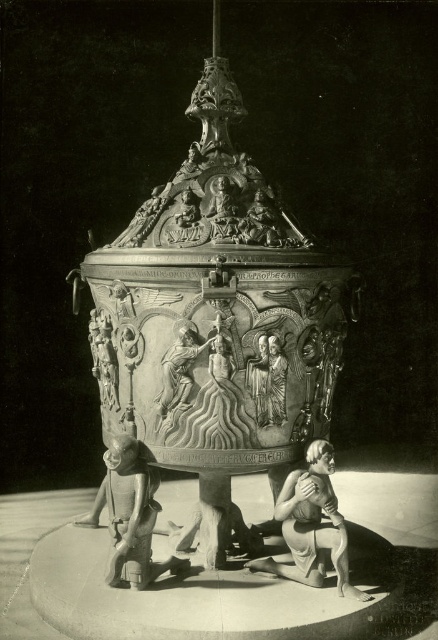
Question: In this image, where is polished bronze baptismal font at center located relative to bronze relief figure at center?

Choices:
 (A) above
 (B) below

Answer: (A)

Question: Which point appears farthest from the camera in this image?

Choices:
 (A) (328, 340)
 (B) (303, 500)

Answer: (A)

Question: Does matte bronze statue at lower center have a greater width compared to polished bronze figure at lower left?

Choices:
 (A) yes
 (B) no

Answer: (B)

Question: Which object is the closest to the matte bronze statue at lower center?

Choices:
 (A) polished bronze baptismal font at center
 (B) polished bronze figure at lower left

Answer: (B)

Question: Is the position of polished bronze baptismal font at center less distant than that of polished bronze figure at lower left?

Choices:
 (A) yes
 (B) no

Answer: (A)

Question: Which object is the farthest from the polished bronze figure at lower left?

Choices:
 (A) matte bronze statue at lower center
 (B) polished bronze baptismal font at center
 (C) bronze relief figure at center

Answer: (B)